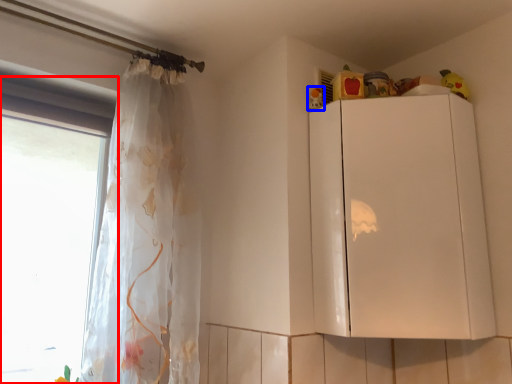
Question: Which of the following is the closest to the observer, window (highlighted by a red box) or toy (highlighted by a blue box)?

Choices:
 (A) window
 (B) toy

Answer: (A)